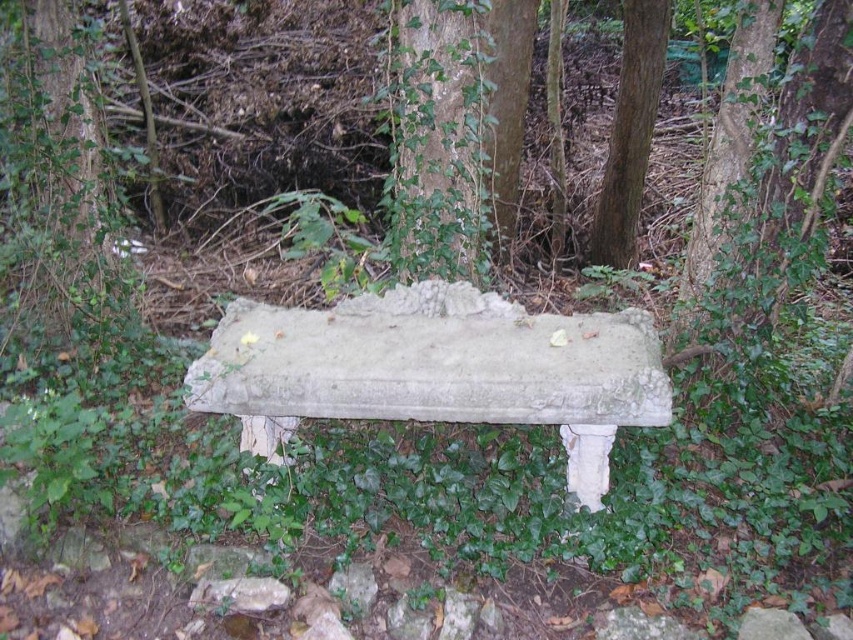
Question: Does gray concrete bench at center have a smaller size compared to green ivy-covered tree at center?

Choices:
 (A) no
 (B) yes

Answer: (A)

Question: Which of the following is the closest to the observer?

Choices:
 (A) green ivy-covered tree at center
 (B) gray concrete bench at center
 (C) smooth brown tree trunk at center right
 (D) green leafy tree at left

Answer: (B)

Question: Among these objects, which one is farthest from the camera?

Choices:
 (A) green ivy-covered tree at center
 (B) smooth brown tree trunk at center right
 (C) green leafy tree at left
 (D) gray concrete bench at center

Answer: (B)

Question: Can you confirm if gray concrete bench at center is thinner than smooth brown tree trunk at center right?

Choices:
 (A) no
 (B) yes

Answer: (A)

Question: Estimate the real-world distances between objects in this image. Which object is farther from the green ivy-covered tree at center?

Choices:
 (A) green leafy tree at left
 (B) gray concrete bench at center

Answer: (A)

Question: Is gray concrete bench at center thinner than smooth brown tree trunk at center right?

Choices:
 (A) no
 (B) yes

Answer: (A)